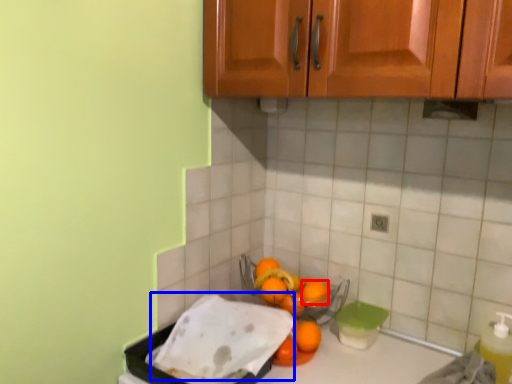
Question: Which object appears closest to the camera in this image, orange (highlighted by a red box) or wash (highlighted by a blue box)?

Choices:
 (A) orange
 (B) wash

Answer: (B)